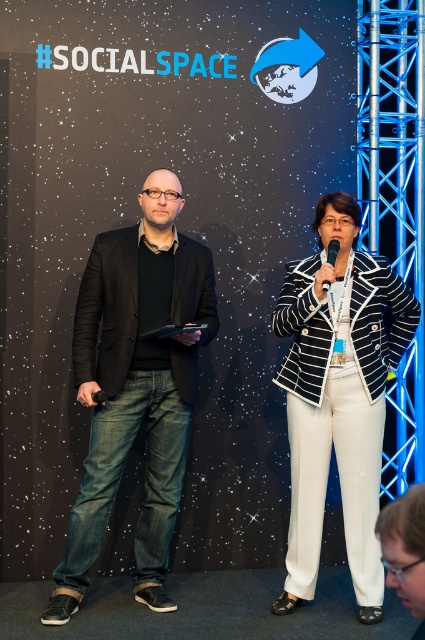
You are an event organizer who needs to decide if the black plastic microphone at center can be placed inside the black and white striped blazer at center during setup. Based on their sizes, is this possible?

The black and white striped blazer at center is larger in size than the black plastic microphone at center, so yes, the microphone can be placed inside the blazer.

In the scene shown: You are an event organizer trying to set up a podium for the speakers. The podium has a height of 1.2 meters. The black and white striped blazer at center belongs to the speaker who will stand behind the podium. The black plastic microphone at center is part of the podium. Considering their heights, will the microphone reach the speaker comfortably?

The black and white striped blazer at center is taller than the black plastic microphone at center. Since the microphone is part of the podium and the speaker is taller, the microphone may not reach the speaker comfortably unless adjusted. The podium is 1.2 meters tall, but the speaker wearing the black and white striped blazer at center is taller than the microphone, so they might need to lower the microphone or adjust their stance to ensure proper reach.